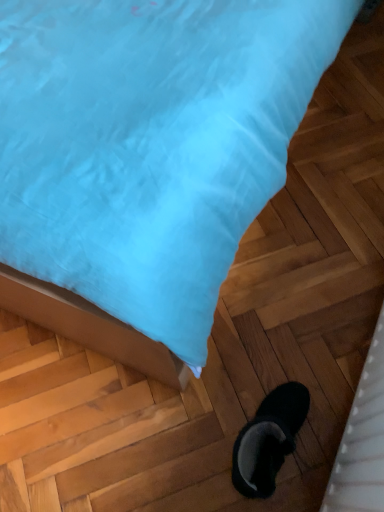
Find the location of a particular element. The width and height of the screenshot is (384, 512). black suede boot at lower right is located at coordinates (269, 440).

What do you see at coordinates (269, 440) in the screenshot? This screenshot has width=384, height=512. I see `black suede boot at lower right` at bounding box center [269, 440].

What is the approximate height of black suede boot at lower right?

black suede boot at lower right is 10.73 inches in height.

Where is `black suede boot at lower right`? The height and width of the screenshot is (512, 384). black suede boot at lower right is located at coordinates (269, 440).